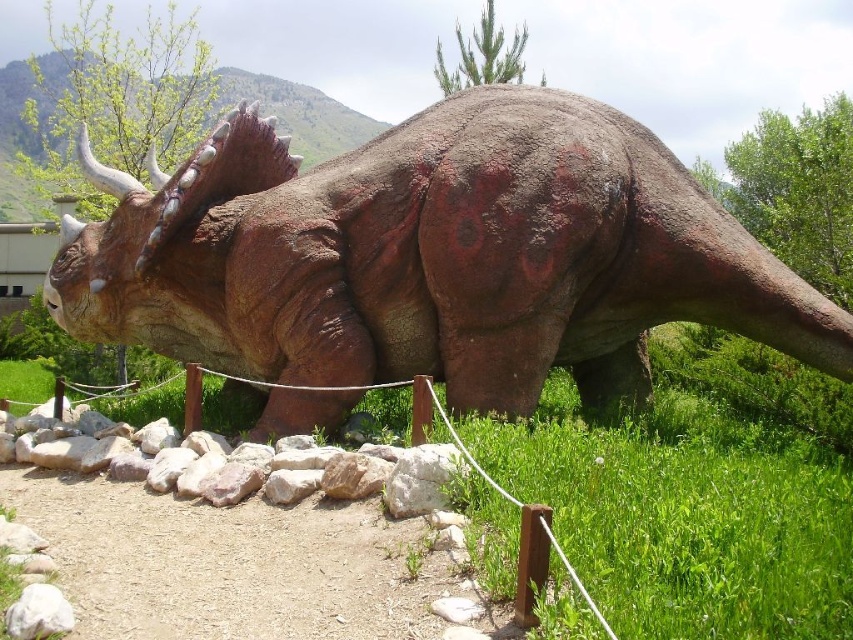
Question: Is rustic stone triceratops at center to the left of green grass at lower right from the viewer's perspective?

Choices:
 (A) no
 (B) yes

Answer: (B)

Question: Is rustic stone triceratops at center further to the viewer compared to green grass at lower right?

Choices:
 (A) no
 (B) yes

Answer: (B)

Question: Is rustic stone triceratops at center further to the viewer compared to green grass at lower right?

Choices:
 (A) no
 (B) yes

Answer: (B)

Question: Which object is closer to the camera taking this photo?

Choices:
 (A) green grass at lower right
 (B) rustic stone triceratops at center

Answer: (A)

Question: Which point is farther from the camera taking this photo?

Choices:
 (A) (582, 436)
 (B) (508, 298)

Answer: (B)